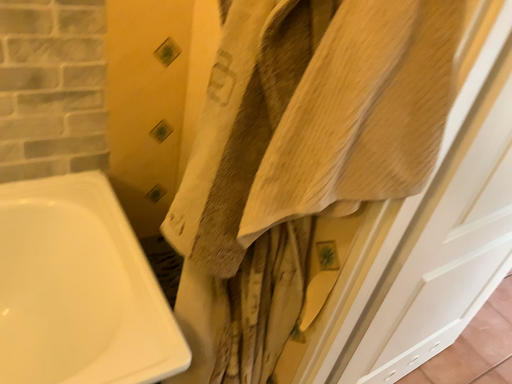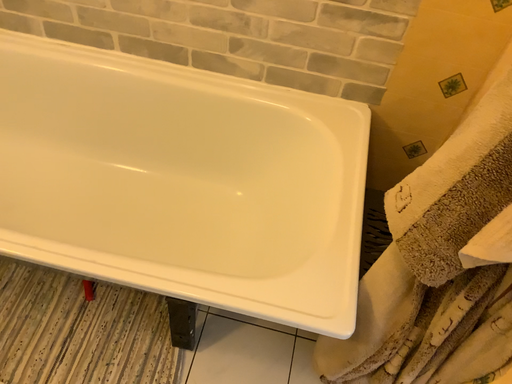
Question: How did the camera likely rotate when shooting the video?

Choices:
 (A) rotated left
 (B) rotated right

Answer: (A)